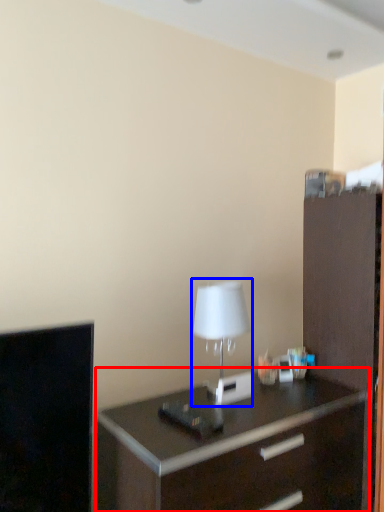
Question: Which of the following is the closest to the observer, chest of drawers (highlighted by a red box) or table lamp (highlighted by a blue box)?

Choices:
 (A) chest of drawers
 (B) table lamp

Answer: (A)